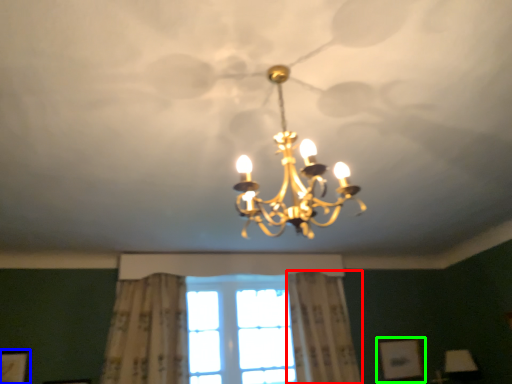
Question: Which object is positioned closest to curtain (highlighted by a red box)? Select from picture frame (highlighted by a blue box) and picture frame (highlighted by a green box).

Choices:
 (A) picture frame
 (B) picture frame

Answer: (B)